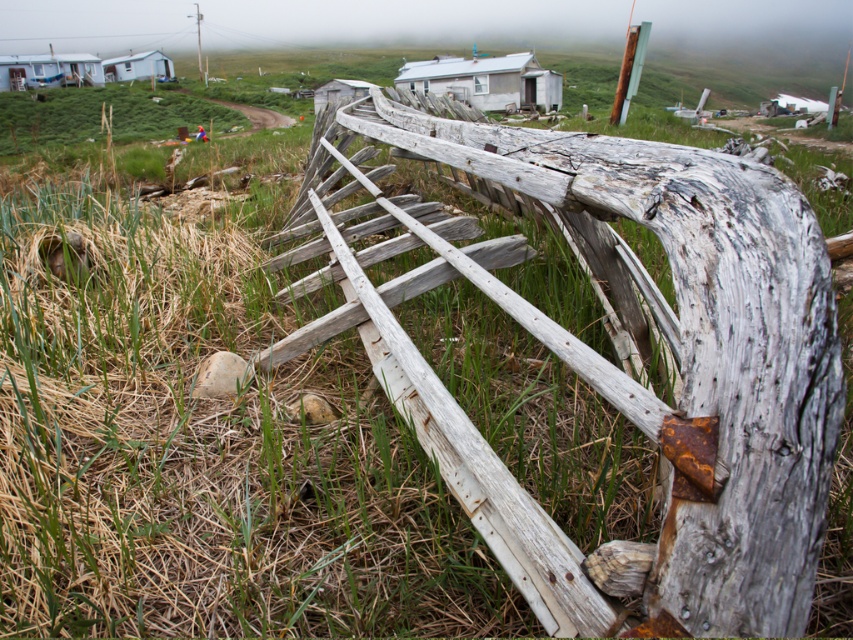
You are planning to install a wireless security camera that has a maximum effective range of 150 feet. You want to monitor both the weathered wood fence at center and the white plastic hut at upper left from a single camera. Is this possible?

The weathered wood fence at center and the white plastic hut at upper left are 156.76 feet apart. Since the camera has a maximum effective range of 150 feet, it cannot cover both locations simultaneously as the distance exceeds the camera range.

You are planning to build a new shed in your backyard. You see the weathered wood fence at center and the white plastic hut at upper left in the image. Which structure would you choose if you want a smaller shed that doesn

The weathered wood fence at center has a smaller size compared to the white plastic hut at upper left, so the weathered wood fence at center would be the better choice for a smaller shed.